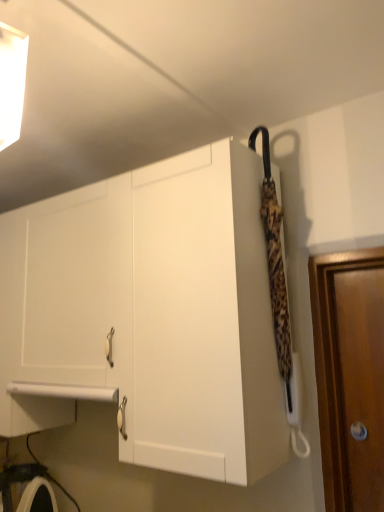
Question: Should I look upward or downward to see white glossy light fixture at upper left?

Choices:
 (A) up
 (B) down

Answer: (A)